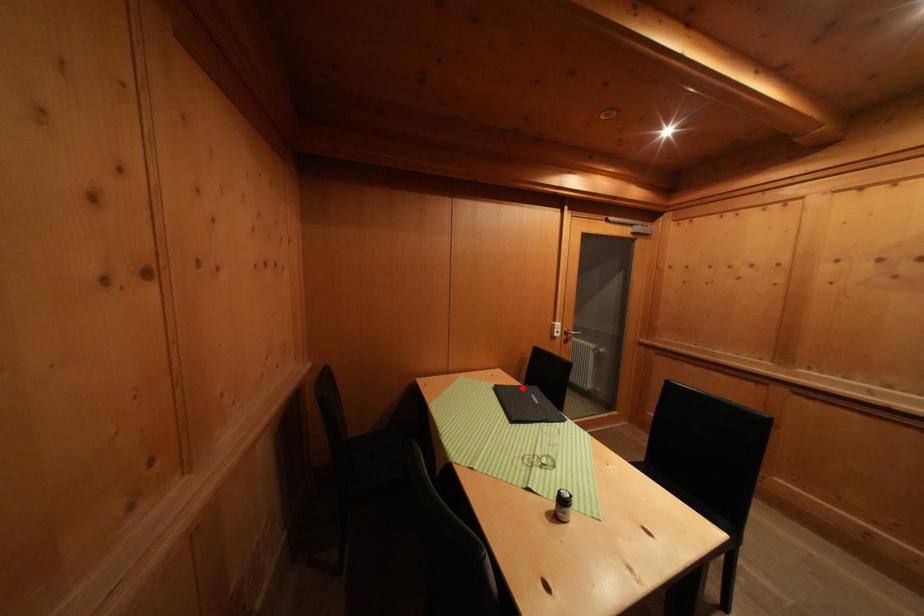
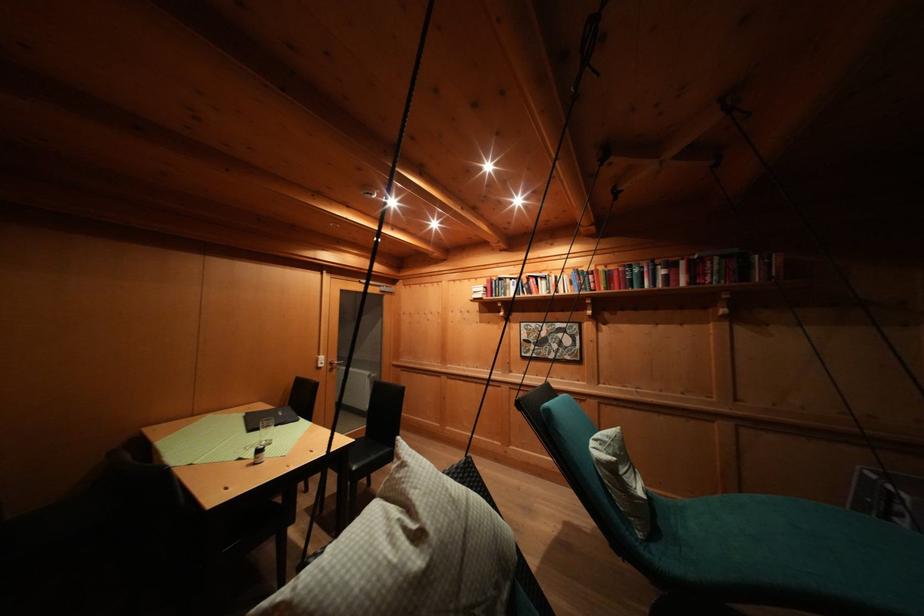
Question: I am providing you with two images of the same scene from different viewpoints. In image1, a red point is highlighted. Considering the same 3D point in image2, which of the following is correct?

Choices:
 (A) It is closer
 (B) It is farther

Answer: (B)